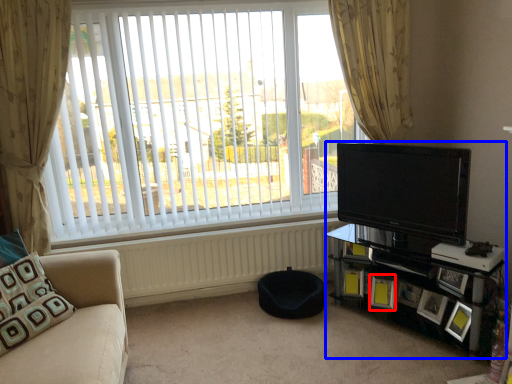
Question: Which point is further to the camera, picture frame (highlighted by a red box) or entertainment center (highlighted by a blue box)?

Choices:
 (A) picture frame
 (B) entertainment center

Answer: (A)